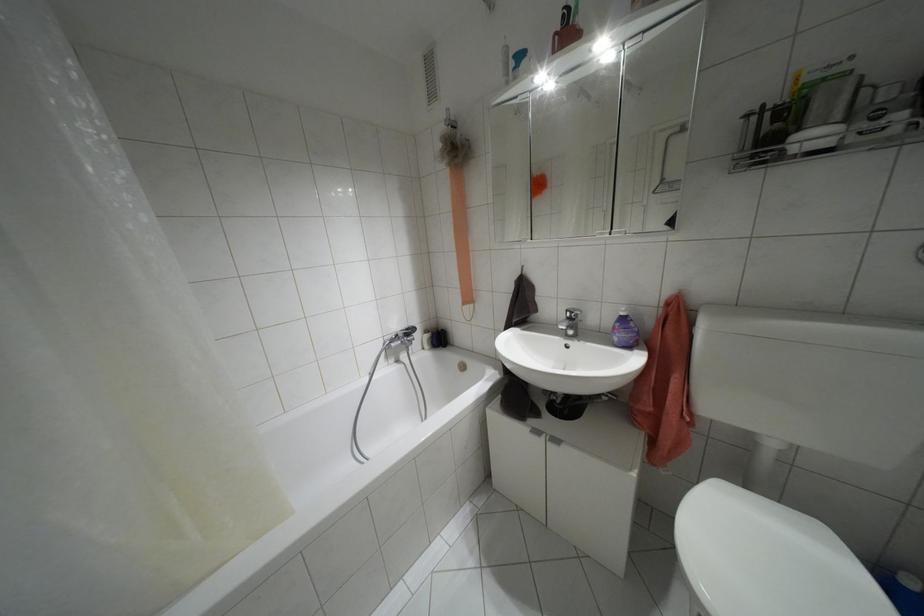
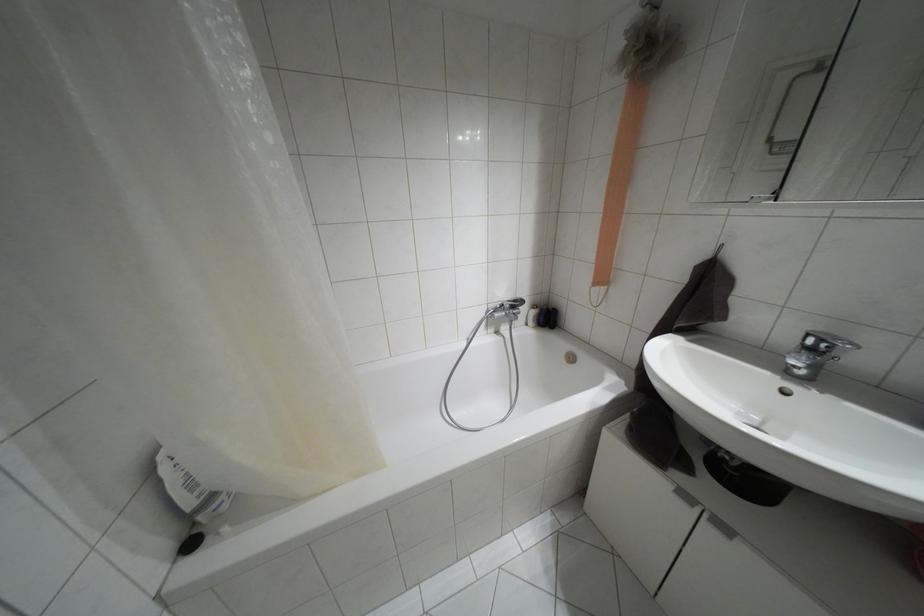
Where in the second image is the point corresponding to the point at 407,329 from the first image?

(514, 301)